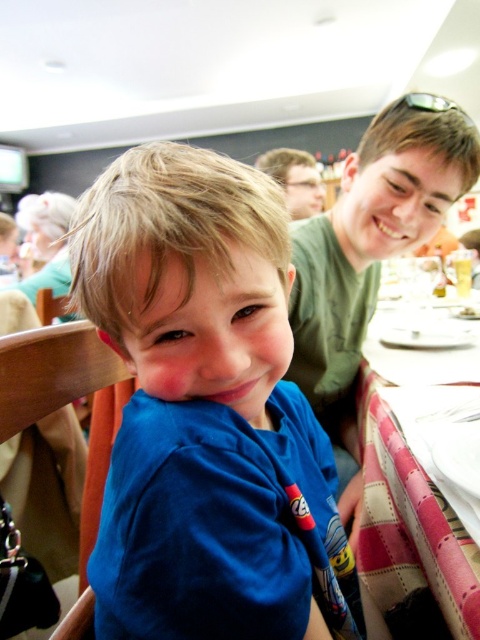
Is point (339, 413) farther from camera compared to point (462, 592)?

Yes, it is.

Measure the distance between blue cotton shirt at right and camera.

The distance of blue cotton shirt at right from camera is 36.53 inches.

The image size is (480, 640). What are the coordinates of `blue cotton shirt at right` in the screenshot? It's located at (371, 243).

The image size is (480, 640). Describe the element at coordinates (205, 412) in the screenshot. I see `blue cotton shirt at center` at that location.

Locate an element on the screen. The width and height of the screenshot is (480, 640). blue cotton shirt at center is located at coordinates (205, 412).

Between point (119, 282) and point (336, 328), which one is positioned in front?

Point (119, 282) is more forward.

The image size is (480, 640). I want to click on blue cotton shirt at center, so click(x=205, y=412).

Does blue cotton shirt at center appear on the right side of pink plaid tablecloth at lower right?

No, blue cotton shirt at center is not to the right of pink plaid tablecloth at lower right.

Find the location of `blue cotton shirt at center`. blue cotton shirt at center is located at coordinates (205, 412).

You are a GUI agent. You are given a task and a screenshot of the screen. Output one action in this format:
    pyautogui.click(x=<x>, y=<y>)
    Task: Click on the blue cotton shirt at center
    Image resolution: width=480 pixels, height=640 pixels.
    Given the screenshot: What is the action you would take?
    pyautogui.click(x=205, y=412)